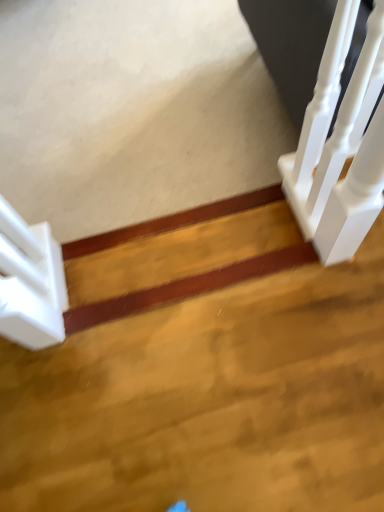
Find the location of a particular element. The height and width of the screenshot is (512, 384). white glossy stair at left is located at coordinates coord(30,282).

The height and width of the screenshot is (512, 384). What do you see at coordinates (30, 282) in the screenshot? I see `white glossy stair at left` at bounding box center [30, 282].

What do you see at coordinates (340, 148) in the screenshot? I see `white glossy stairwell at upper right` at bounding box center [340, 148].

Identify the location of white glossy stairwell at upper right. (340, 148).

Locate an element on the screen. white glossy stair at left is located at coordinates (30, 282).

Which object is positioned more to the right, white glossy stairwell at upper right or white glossy stair at left?

white glossy stairwell at upper right.

Considering their positions, is white glossy stairwell at upper right located in front of or behind white glossy stair at left?

In the image, white glossy stairwell at upper right appears in front of white glossy stair at left.

Is point (368, 157) farther from camera compared to point (14, 244)?

That is False.

From the image's perspective, which object appears higher, white glossy stairwell at upper right or white glossy stair at left?

From the image's view, white glossy stairwell at upper right is above.

From a real-world perspective, is white glossy stairwell at upper right physically above white glossy stair at left?

Correct, in the physical world, white glossy stairwell at upper right is higher than white glossy stair at left.

Can you confirm if white glossy stairwell at upper right is thinner than white glossy stair at left?

Correct, the width of white glossy stairwell at upper right is less than that of white glossy stair at left.

From the picture: Can you confirm if white glossy stairwell at upper right is taller than white glossy stair at left?

Yes, white glossy stairwell at upper right is taller than white glossy stair at left.

Can you confirm if white glossy stairwell at upper right is smaller than white glossy stair at left?

Incorrect, white glossy stairwell at upper right is not smaller in size than white glossy stair at left.

Can we say white glossy stairwell at upper right lies outside white glossy stair at left?

Yes, white glossy stairwell at upper right is outside of white glossy stair at left.

Can you see white glossy stairwell at upper right touching white glossy stair at left?

They are not placed beside each other.

Is white glossy stairwell at upper right turned away from white glossy stair at left?

white glossy stairwell at upper right is not turned away from white glossy stair at left.

Can you tell me how much white glossy stairwell at upper right and white glossy stair at left differ in facing direction?

white glossy stairwell at upper right and white glossy stair at left are facing 177 degrees away from each other.

Image resolution: width=384 pixels, height=512 pixels. In the image, there is a white glossy stairwell at upper right. Identify the location of stairs below it (from the image's perspective). (30, 282).

Which is more to the right, white glossy stair at left or white glossy stairwell at upper right?

From the viewer's perspective, white glossy stairwell at upper right appears more on the right side.

Considering their positions, is white glossy stair at left located in front of or behind white glossy stairwell at upper right?

white glossy stair at left is behind white glossy stairwell at upper right.

Between point (46, 256) and point (320, 88), which one is positioned in front?

The point (320, 88) is closer.

From the image's perspective, between white glossy stair at left and white glossy stairwell at upper right, who is located below?

white glossy stair at left is shown below in the image.

From a real-world perspective, who is located lower, white glossy stair at left or white glossy stairwell at upper right?

From a 3D spatial view, white glossy stair at left is below.

Looking at their sizes, would you say white glossy stair at left is wider or thinner than white glossy stairwell at upper right?

Considering their sizes, white glossy stair at left looks broader than white glossy stairwell at upper right.

Is white glossy stair at left taller than white glossy stairwell at upper right?

No, white glossy stair at left is not taller than white glossy stairwell at upper right.

Can you confirm if white glossy stair at left is smaller than white glossy stairwell at upper right?

Yes, white glossy stair at left is smaller than white glossy stairwell at upper right.

Is white glossy stair at left located outside white glossy stairwell at upper right?

Yes.

In the scene shown: Is white glossy stair at left not near white glossy stairwell at upper right?

They are positioned close to each other.

Is white glossy stair at left facing towards white glossy stairwell at upper right?

Yes.

Identify the location of stairs below the white glossy stairwell at upper right (from the image's perspective). This screenshot has width=384, height=512. (30, 282).

This screenshot has width=384, height=512. In order to click on stairwell above the white glossy stair at left (from a real-world perspective) in this screenshot , I will do `click(340, 148)`.

The image size is (384, 512). I want to click on stairwell located on the right of white glossy stair at left, so click(340, 148).